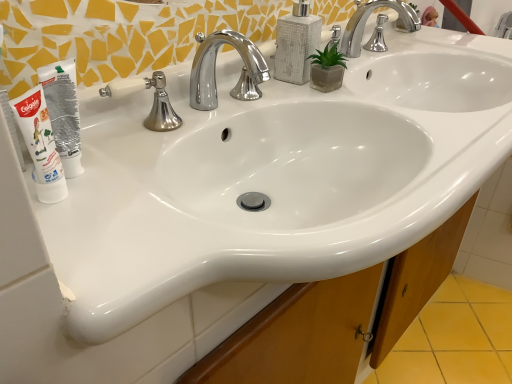
Question: Is chrome/metallic faucet at upper center, the first tap viewed from the right, shorter than silver/chrome faucet at center?

Choices:
 (A) no
 (B) yes

Answer: (A)

Question: Does chrome/metallic faucet at upper center, which ranks as the 1th tap in top-to-bottom order, appear on the right side of silver/chrome faucet at center?

Choices:
 (A) yes
 (B) no

Answer: (A)

Question: Considering the relative sizes of chrome/metallic faucet at upper center, which ranks as the 1th tap in top-to-bottom order, and silver/chrome faucet at center in the image provided, is chrome/metallic faucet at upper center, which ranks as the 1th tap in top-to-bottom order, wider than silver/chrome faucet at center?

Choices:
 (A) no
 (B) yes

Answer: (B)

Question: From a real-world perspective, is chrome/metallic faucet at upper center, the first tap viewed from the right, physically above silver/chrome faucet at center?

Choices:
 (A) no
 (B) yes

Answer: (B)

Question: Is chrome/metallic faucet at upper center, marked as the second tap in a bottom-to-top arrangement, positioned with its back to silver/chrome faucet at center?

Choices:
 (A) no
 (B) yes

Answer: (A)

Question: Considering the positions of point (155, 76) and point (293, 66), is point (155, 76) closer or farther from the camera than point (293, 66)?

Choices:
 (A) farther
 (B) closer

Answer: (B)

Question: Which is correct: silver/chrome faucet at center is inside white textured soap dispenser at upper center, or outside of it?

Choices:
 (A) outside
 (B) inside

Answer: (A)

Question: Considering the positions of silver/chrome faucet at center and white textured soap dispenser at upper center in the image, is silver/chrome faucet at center taller or shorter than white textured soap dispenser at upper center?

Choices:
 (A) tall
 (B) short

Answer: (B)

Question: From the image's perspective, is silver/chrome faucet at center positioned above or below white textured soap dispenser at upper center?

Choices:
 (A) above
 (B) below

Answer: (B)

Question: Is polished chrome faucet at center, which is the first tap in bottom-to-top order, inside or outside of chrome/metallic faucet at upper center, positioned as the 2th tap in front-to-back order?

Choices:
 (A) inside
 (B) outside

Answer: (B)

Question: Is polished chrome faucet at center, the 1th tap in the left-to-right sequence, wider or thinner than chrome/metallic faucet at upper center, which ranks as the 1th tap in top-to-bottom order?

Choices:
 (A) thin
 (B) wide

Answer: (B)

Question: Is polished chrome faucet at center, which is the first tap in bottom-to-top order, in front of or behind chrome/metallic faucet at upper center, which is counted as the first tap, starting from the back, in the image?

Choices:
 (A) behind
 (B) front

Answer: (B)

Question: Looking at the image, does polished chrome faucet at center, which is the first tap in bottom-to-top order, seem bigger or smaller compared to chrome/metallic faucet at upper center, positioned as the 2th tap in front-to-back order?

Choices:
 (A) big
 (B) small

Answer: (B)

Question: From a real-world perspective, is white tube at left above or below silver/chrome faucet at center?

Choices:
 (A) above
 (B) below

Answer: (A)

Question: Relative to silver/chrome faucet at center, is white tube at left in front or behind?

Choices:
 (A) front
 (B) behind

Answer: (A)